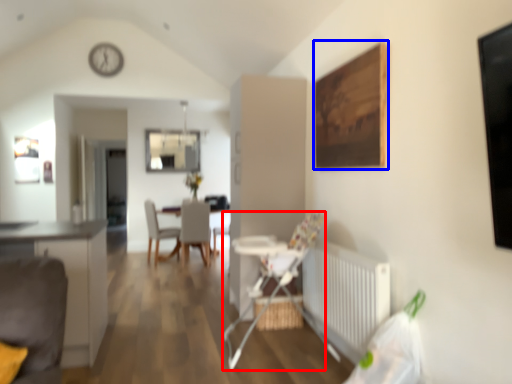
Question: Which object is closer to the camera taking this photo, armchair (highlighted by a red box) or picture frame (highlighted by a blue box)?

Choices:
 (A) armchair
 (B) picture frame

Answer: (B)